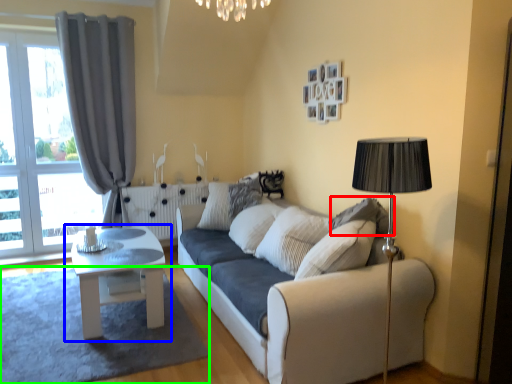
Question: Considering the real-world distances, which object is farthest from pillow (highlighted by a red box)? table (highlighted by a blue box) or plain (highlighted by a green box)?

Choices:
 (A) table
 (B) plain

Answer: (B)